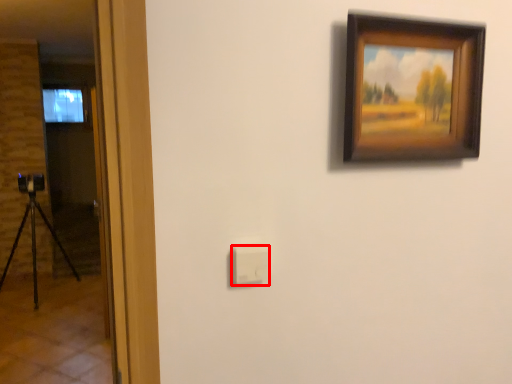
Question: From the image's perspective, what is the correct spatial relationship of light switch (annotated by the red box) in relation to picture frame?

Choices:
 (A) below
 (B) above

Answer: (A)